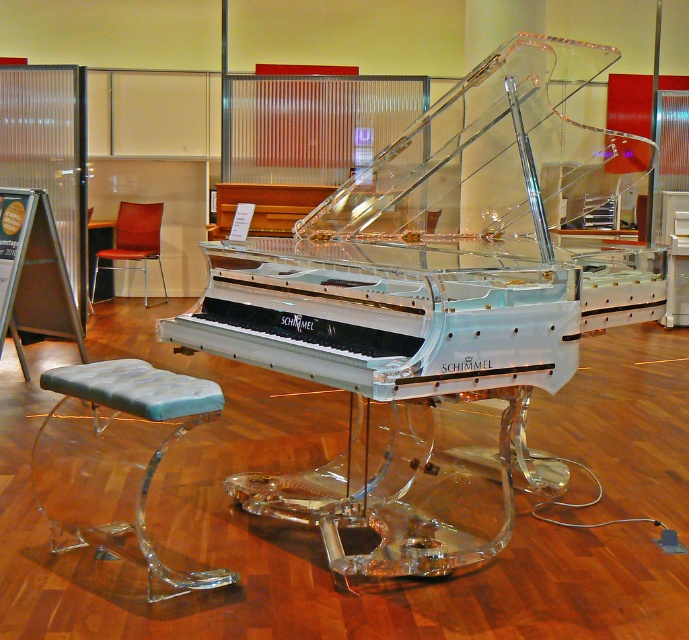
Can you confirm if clear acrylic stool at center is positioned below leather seat at center?

Correct, clear acrylic stool at center is located below leather seat at center.

What do you see at coordinates (116, 458) in the screenshot? The height and width of the screenshot is (640, 689). I see `clear acrylic stool at center` at bounding box center [116, 458].

From the picture: Who is more forward, (94, 381) or (133, 232)?

Point (94, 381) is in front.

At what (x,y) coordinates should I click in order to perform the action: click on clear acrylic stool at center. Please return your answer as a coordinate pair (x, y). Looking at the image, I should click on [116, 458].

Who is shorter, transparent acrylic piano at center or leather seat at center?

leather seat at center

Image resolution: width=689 pixels, height=640 pixels. In order to click on transparent acrylic piano at center in this screenshot , I will do `click(442, 308)`.

Between point (493, 362) and point (130, 241), which one is positioned behind?

The point (130, 241) is behind.

Identify the location of transparent acrylic piano at center. This screenshot has height=640, width=689. (442, 308).

Is point (593, 228) positioned behind point (114, 499)?

Yes, point (593, 228) is farther from viewer.

Who is positioned more to the left, transparent acrylic piano at center or clear acrylic stool at center?

Positioned to the left is clear acrylic stool at center.

Describe the element at coordinates (442, 308) in the screenshot. The image size is (689, 640). I see `transparent acrylic piano at center` at that location.

At what (x,y) coordinates should I click in order to perform the action: click on transparent acrylic piano at center. Please return your answer as a coordinate pair (x, y). The width and height of the screenshot is (689, 640). Looking at the image, I should click on (442, 308).